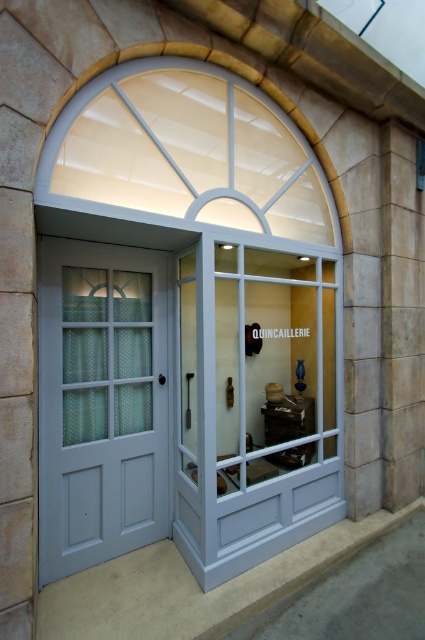
You are a delivery person trying to enter the building. You see a clear glass door at center and a matte gray door at center. Which door should you use to enter?

The clear glass door at center is positioned over the matte gray door at center, so the matte gray door at center is likely the entrance as it is below and more accessible.

You are a delivery person with a package that requires a 2.5 meter clearance to deliver. You are standing in front of the matte gray door at center. Can you safely deliver the package without moving the camera that is 2.71 meters away from the door?

The distance between the matte gray door at center and the camera is 2.71 meters, which is greater than the required 2.5 meter clearance. Therefore, you can safely deliver the package without moving the camera.

You are a delivery person with a large package that requires a clearance of 1 meter between the door and the window to safely maneuver around it. Based on the scene described, can you safely navigate through the space between the matte gray door at center and the white glass window at upper center?

The matte gray door at center and white glass window at upper center are 98.09 centimeters apart. Since 98.09 cm is less than 1 meter, the required clearance of 1 meter is not met. Therefore, you cannot safely maneuver the package through the space between them.